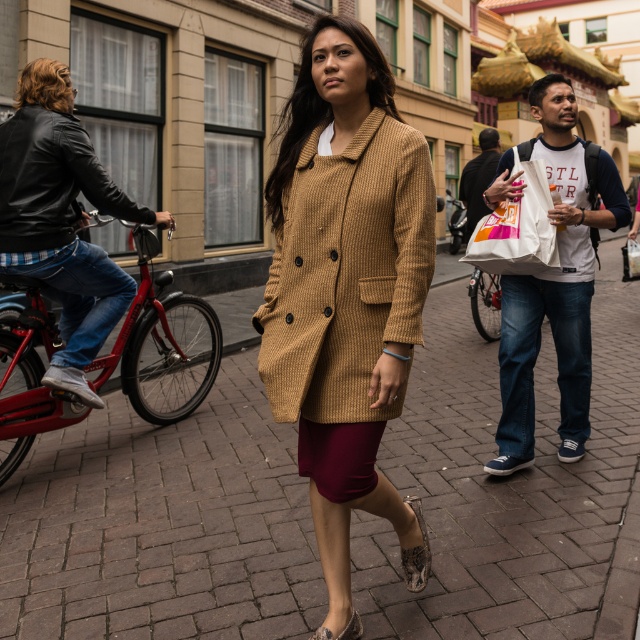
Question: Is brown brick pavement at center thinner than shiny red bicycle at left?

Choices:
 (A) no
 (B) yes

Answer: (B)

Question: Which object is closer to the camera taking this photo?

Choices:
 (A) shiny red bicycle at left
 (B) woven beige coat at center
 (C) leather sandal at lower center
 (D) leather textured sandal at lower center

Answer: (B)

Question: Is white cotton tote bag at right above shiny black bicycle at center?

Choices:
 (A) no
 (B) yes

Answer: (A)

Question: Among these objects, which one is farthest from the camera?

Choices:
 (A) white cotton tote bag at right
 (B) leather sandal at lower center

Answer: (A)

Question: Does brown brick pavement at center have a larger size compared to white paper bag at center?

Choices:
 (A) no
 (B) yes

Answer: (A)

Question: Which is nearer to the matte black leather jacket at left?

Choices:
 (A) leather textured sandal at lower center
 (B) leather sandal at lower center
 (C) white paper bag at center
 (D) white paper bag at right

Answer: (A)